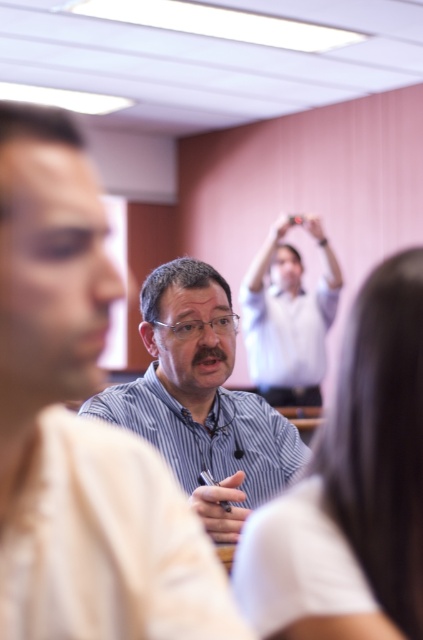
Does striped shirt at center have a lesser height compared to matte black hand at upper center?

No, striped shirt at center is not shorter than matte black hand at upper center.

Does striped shirt at center appear on the right side of matte black hand at upper center?

In fact, striped shirt at center is to the left of matte black hand at upper center.

Is point (167, 291) farther from viewer compared to point (315, 224)?

No.

Image resolution: width=423 pixels, height=640 pixels. What are the coordinates of `striped shirt at center` in the screenshot? It's located at (202, 401).

Which is more to the right, striped shirt at center or matte black pen at center?

matte black pen at center is more to the right.

Which of these two, striped shirt at center or matte black pen at center, stands shorter?

Standing shorter between the two is matte black pen at center.

From the picture: Who is more distant from viewer, (192, 497) or (247, 513)?

The point (247, 513) is more distant.

I want to click on striped shirt at center, so click(202, 401).

Which is more to the left, light blue striped shirt at center or matte black hand at upper center?

Positioned to the left is light blue striped shirt at center.

Can you confirm if light blue striped shirt at center is wider than matte black hand at upper center?

Correct, the width of light blue striped shirt at center exceeds that of matte black hand at upper center.

I want to click on light blue striped shirt at center, so click(288, 323).